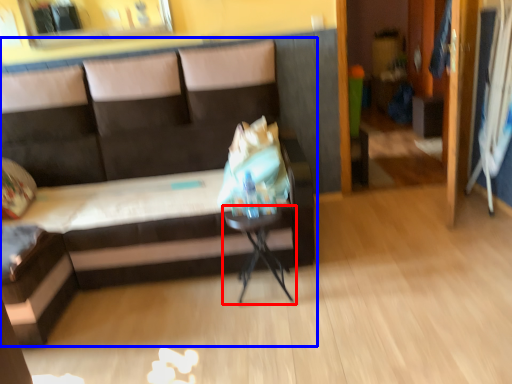
Question: Which point is further to the camera, table (highlighted by a red box) or studio couch (highlighted by a blue box)?

Choices:
 (A) table
 (B) studio couch

Answer: (A)